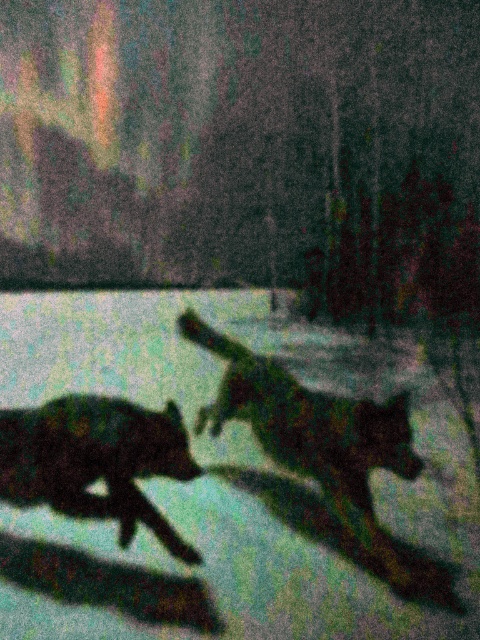
You are a photographer who wants to capture a clear image of the shiny black dog at center and the silhouette fur at lower left. Based on their positions, which object should you focus on first to ensure both are in focus?

The silhouette fur at lower left should be focused on first since the shiny black dog at center is above it, allowing the depth of field to cover both when focusing on the closer object.

You are a photographer who wants to capture a closeup of the shiny black dog at center. You are currently focusing on the point at coordinates point (327, 456). Is this point on the shiny black dog at center?

Yes, the point (327, 456) is on the shiny black dog at center, so focusing there will capture the dog in focus.

You are a photographer trying to capture a photo of the shiny black dog at center and the silhouette fur at lower left. Which object should you focus on if you want to ensure the wider one is in sharp focus?

The shiny black dog at center should be focused on because it might be wider than the silhouette fur at lower left.